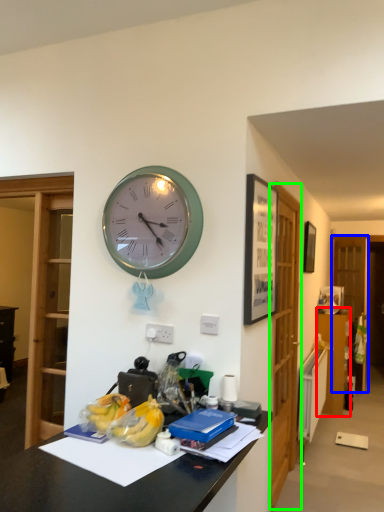
Question: Based on their relative distances, which object is farther from dresser (highlighted by a red box)? Choose from glass door (highlighted by a blue box) and glass door (highlighted by a green box).

Choices:
 (A) glass door
 (B) glass door

Answer: (B)